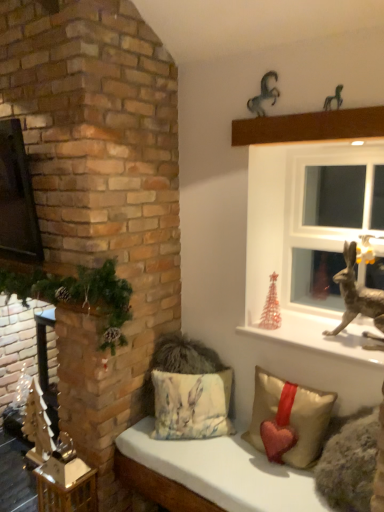
Question: Is fluffy fabric cushion at lower center closer to the viewer compared to metallic horse at upper right, which is counted as the 1th animal, starting from the right?

Choices:
 (A) yes
 (B) no

Answer: (A)

Question: Is fluffy fabric cushion at lower center oriented towards metallic horse at upper right, which is the 1th animal in front-to-back order?

Choices:
 (A) yes
 (B) no

Answer: (B)

Question: Would you say fluffy fabric cushion at lower center contains metallic horse at upper right, which is the 1th animal in front-to-back order?

Choices:
 (A) yes
 (B) no

Answer: (B)

Question: Is fluffy fabric cushion at lower center smaller than metallic horse at upper right, which is counted as the 1th animal, starting from the right?

Choices:
 (A) no
 (B) yes

Answer: (A)

Question: Considering the relative positions of fluffy fabric cushion at lower center and metallic horse at upper right, which is counted as the 1th animal, starting from the right, in the image provided, is fluffy fabric cushion at lower center to the right of metallic horse at upper right, which is counted as the 1th animal, starting from the right, from the viewer's perspective?

Choices:
 (A) yes
 (B) no

Answer: (B)

Question: Do you think metallic gold statue at upper right is within shiny metallic reindeer at right, or outside of it?

Choices:
 (A) inside
 (B) outside

Answer: (B)

Question: Considering their positions, is metallic gold statue at upper right located in front of or behind shiny metallic reindeer at right?

Choices:
 (A) behind
 (B) front

Answer: (B)

Question: Is point (309, 326) positioned closer to the camera than point (345, 281)?

Choices:
 (A) closer
 (B) farther

Answer: (B)

Question: From the image's perspective, is metallic gold statue at upper right positioned above or below shiny metallic reindeer at right?

Choices:
 (A) above
 (B) below

Answer: (B)

Question: Considering the positions of metallic silver horse at upper center, the second animal when ordered from right to left, and metallic brown ledge at upper center in the image, is metallic silver horse at upper center, the second animal when ordered from right to left, taller or shorter than metallic brown ledge at upper center?

Choices:
 (A) short
 (B) tall

Answer: (B)

Question: Considering the positions of point (271, 91) and point (370, 134), is point (271, 91) closer or farther from the camera than point (370, 134)?

Choices:
 (A) closer
 (B) farther

Answer: (B)

Question: From the image's perspective, is metallic silver horse at upper center, which is the 2th animal in front-to-back order, positioned above or below metallic brown ledge at upper center?

Choices:
 (A) above
 (B) below

Answer: (A)

Question: From a real-world perspective, is metallic silver horse at upper center, which is the 2th animal in front-to-back order, physically located above or below metallic brown ledge at upper center?

Choices:
 (A) above
 (B) below

Answer: (A)

Question: Based on their positions, is shiny metallic reindeer at right located to the left or right of translucent glass christmas tree at right, marked as the 2th christmas decoration in a left-to-right arrangement?

Choices:
 (A) right
 (B) left

Answer: (A)

Question: Is shiny metallic reindeer at right spatially inside translucent glass christmas tree at right, the 2th christmas decoration positioned from the front, or outside of it?

Choices:
 (A) inside
 (B) outside

Answer: (B)